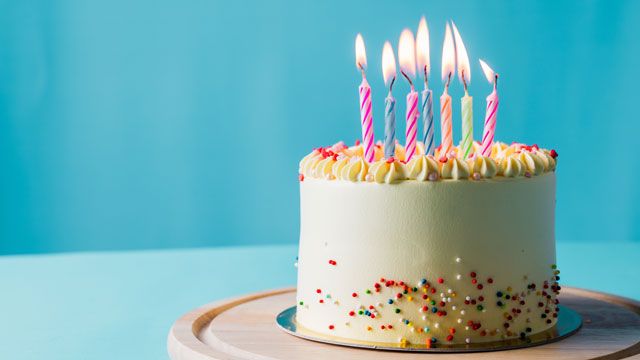
Image resolution: width=640 pixels, height=360 pixels. Identify the location of birthday candles. (370, 122), (388, 130), (408, 127), (428, 125), (449, 126), (468, 128), (493, 127).